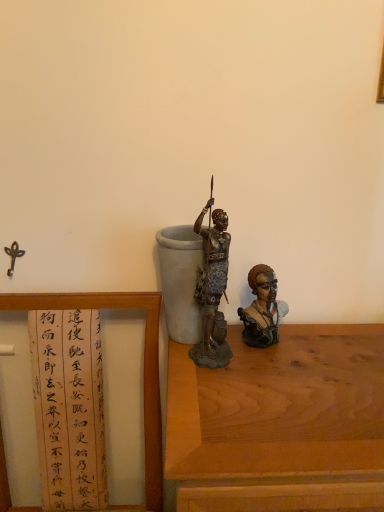
This screenshot has width=384, height=512. Identify the location of free space above wooden table at center (from a real-world perspective). (300, 372).